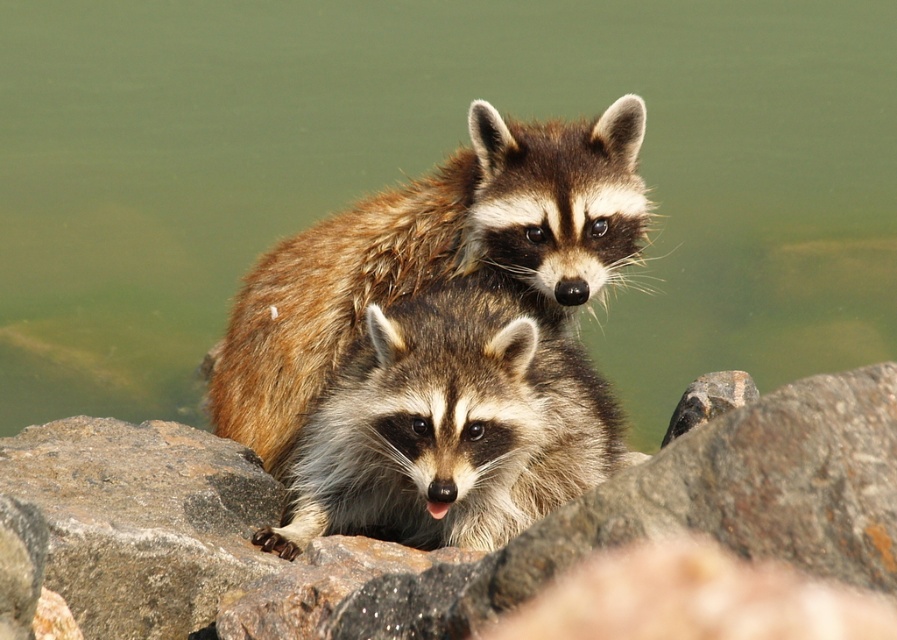
You are a photographer trying to capture both the brown rough rock at center and the fuzzy brown raccoon at center in a single shot. Based on their heights, which one should you focus on first to ensure both are in frame?

The brown rough rock at center is not as tall as the fuzzy brown raccoon at center, so you should focus on the fuzzy brown raccoon at center first to ensure both are in frame.

You are a wildlife photographer trying to capture both raccoons in a single photo. Given that the fuzzy brown raccoon at center is blocking part of the brown furry raccoon at center, can you adjust your position to include both without moving the raccoons?

The fuzzy brown raccoon at center occupies less space than the brown furry raccoon at center, so you can move your camera position to the side to capture both raccoons in the frame, as the smaller raccoon may not fully block the larger one if positioned appropriately.